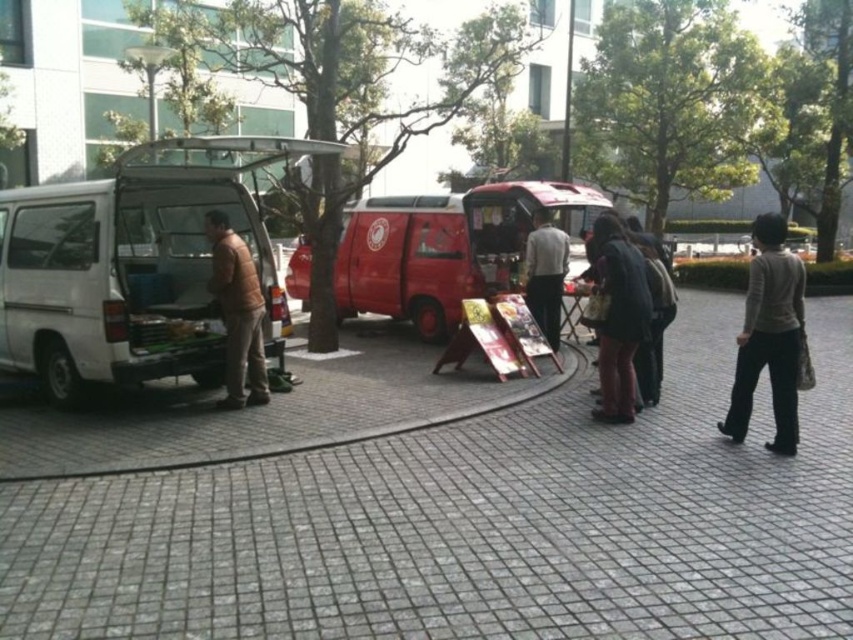
Which is more to the left, white matte van at left or shiny red van at center?

white matte van at left is more to the left.

Is white matte van at left to the left of shiny red van at center from the viewer's perspective?

Correct, you'll find white matte van at left to the left of shiny red van at center.

Consider the image. Who is more distant from viewer, (152, 292) or (339, 304)?

Point (339, 304)

Image resolution: width=853 pixels, height=640 pixels. I want to click on white matte van at left, so click(x=132, y=266).

Which is in front, point (463, 275) or point (772, 396)?

Point (772, 396)

Does shiny red van at center appear on the left side of light gray sweater at right?

Indeed, shiny red van at center is positioned on the left side of light gray sweater at right.

Is point (404, 211) in front of point (802, 326)?

No.

What are the coordinates of `shiny red van at center` in the screenshot? It's located at (444, 248).

Who is higher up, white matte van at left or dark brown leather jacket at center?

white matte van at left is higher up.

Is point (141, 182) positioned in front of point (611, 396)?

No.

Who is more distant from viewer, (178, 186) or (633, 337)?

Point (178, 186)

Identify the location of white matte van at left. The image size is (853, 640). (132, 266).